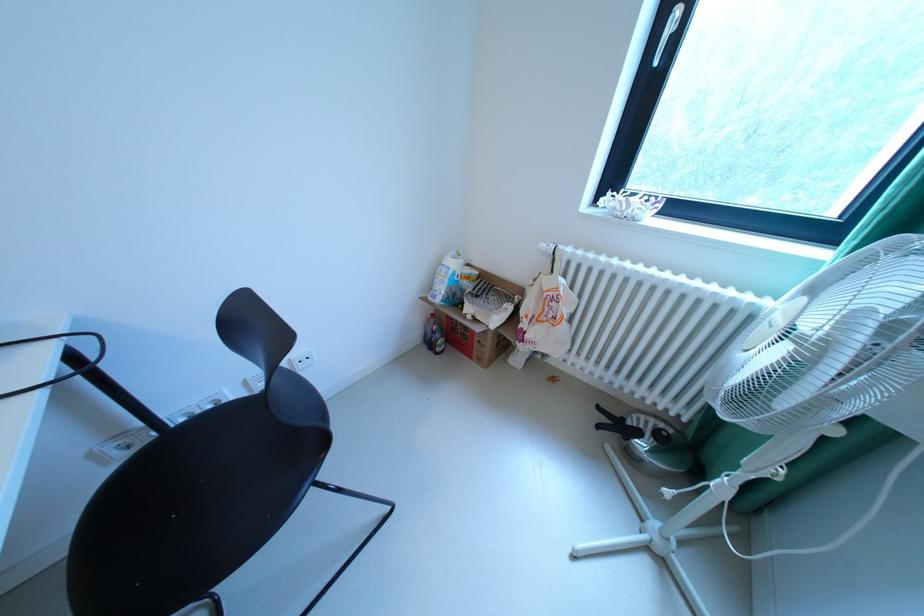
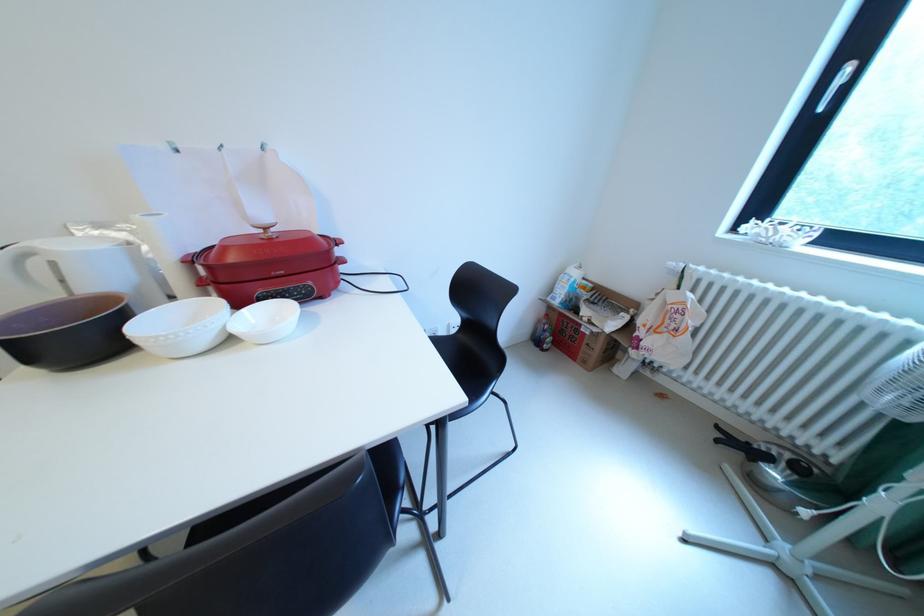
In a continuous first-person perspective shot, in which direction is the camera moving?

The cameraman moved toward left, backward.